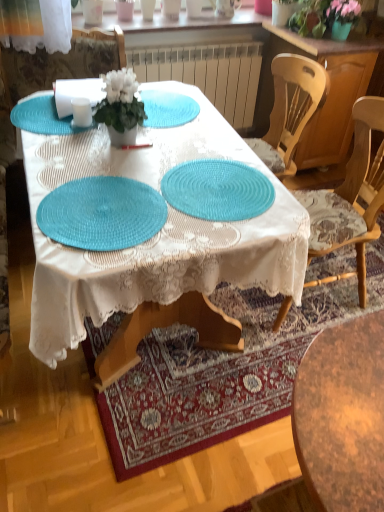
Where is `empty space that is in between white matte pot at center and teal woven placemat at center, which ranks as the second glass plate in top-to-bottom order`? The height and width of the screenshot is (512, 384). empty space that is in between white matte pot at center and teal woven placemat at center, which ranks as the second glass plate in top-to-bottom order is located at coordinates (168, 156).